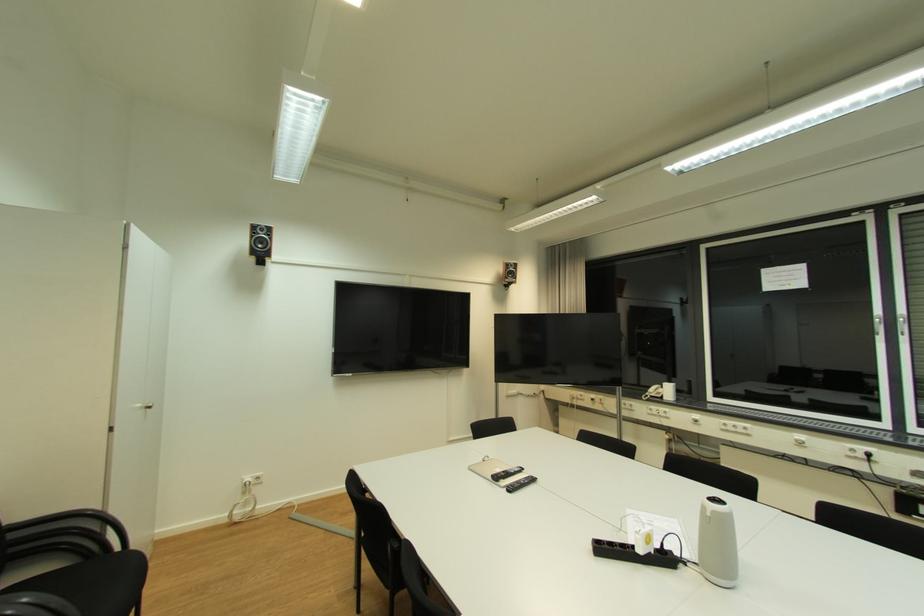
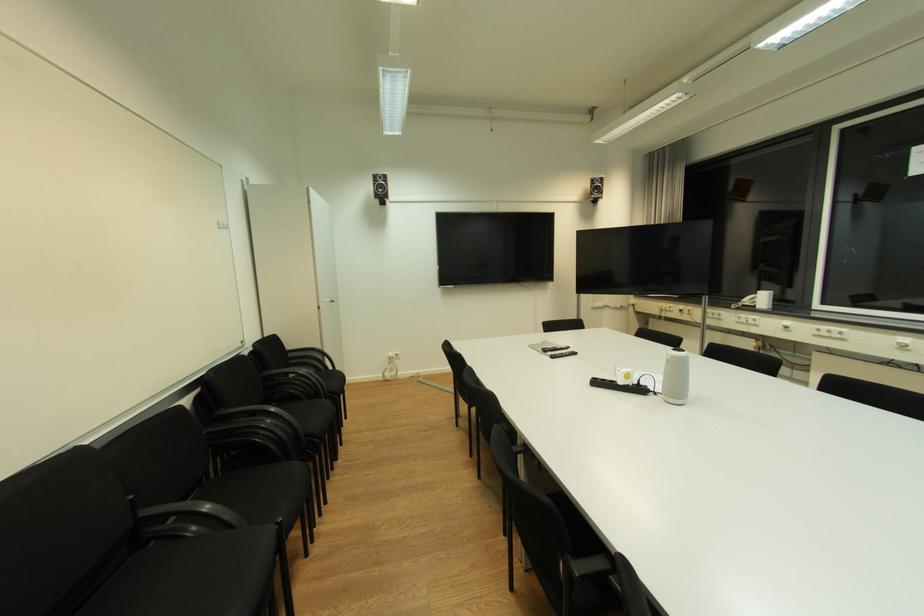
The point at [253,480] is marked in the first image. Where is the corresponding point in the second image?

(396, 355)